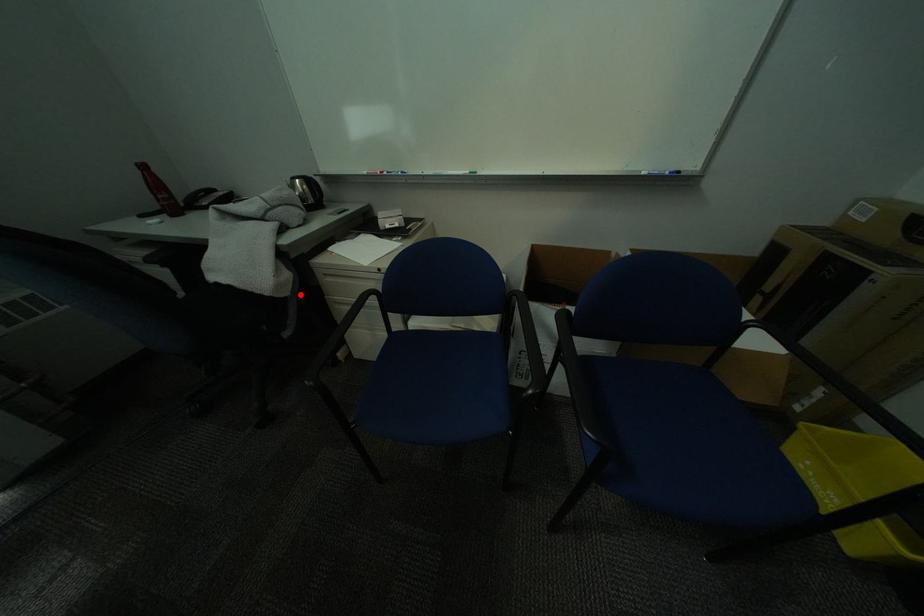
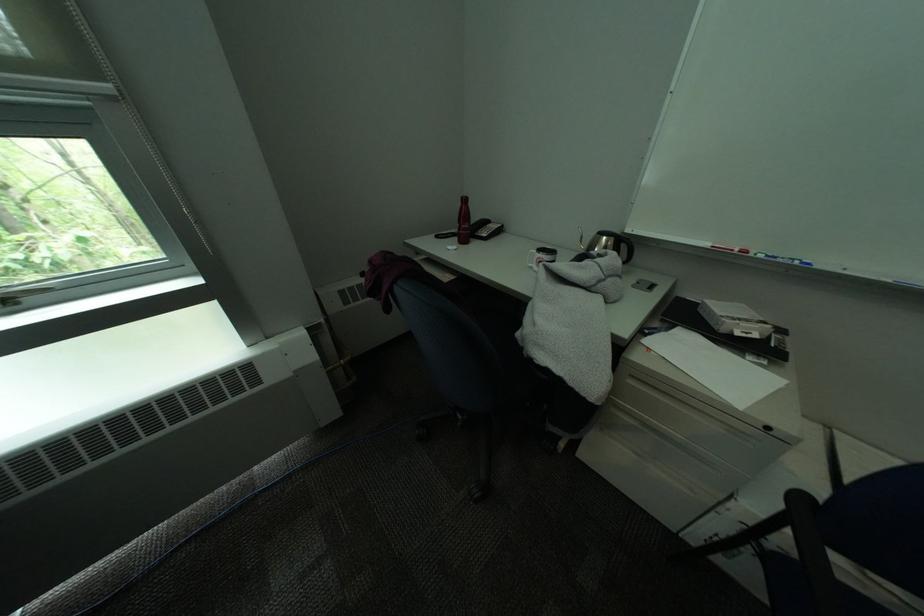
In the second image, find the point that corresponds to the highlighted location in the first image.

(615, 402)